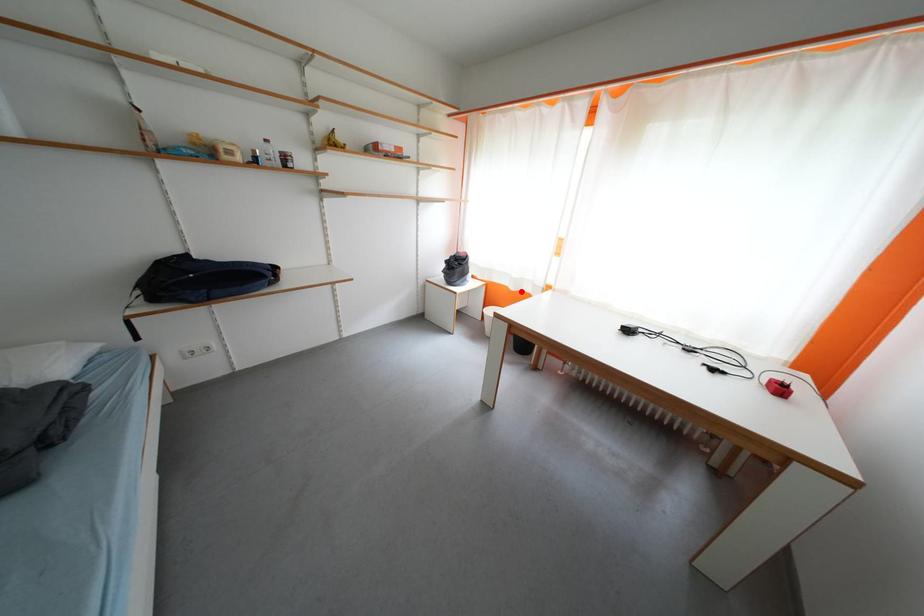
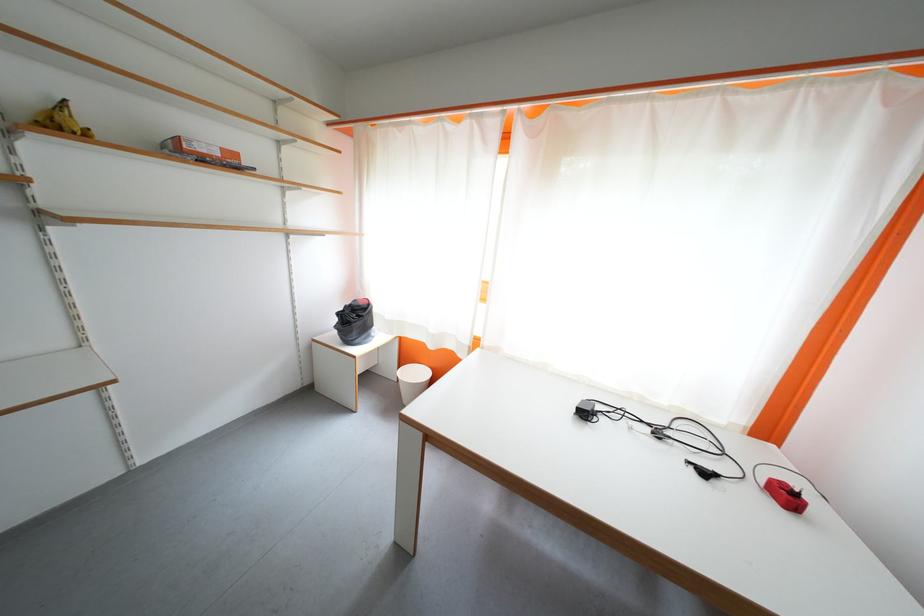
The point at the highlighted location is marked in the first image. Where is the corresponding point in the second image?

(440, 350)